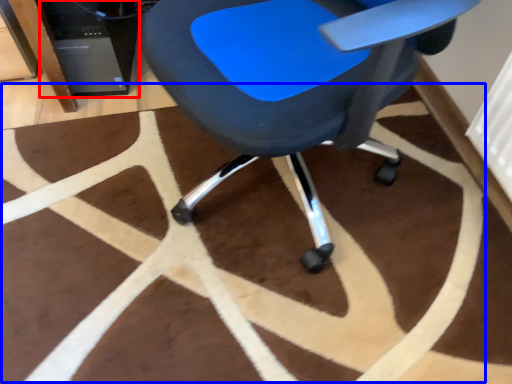
Question: Which object is further to the camera taking this photo, computer tower (highlighted by a red box) or mat (highlighted by a blue box)?

Choices:
 (A) computer tower
 (B) mat

Answer: (A)